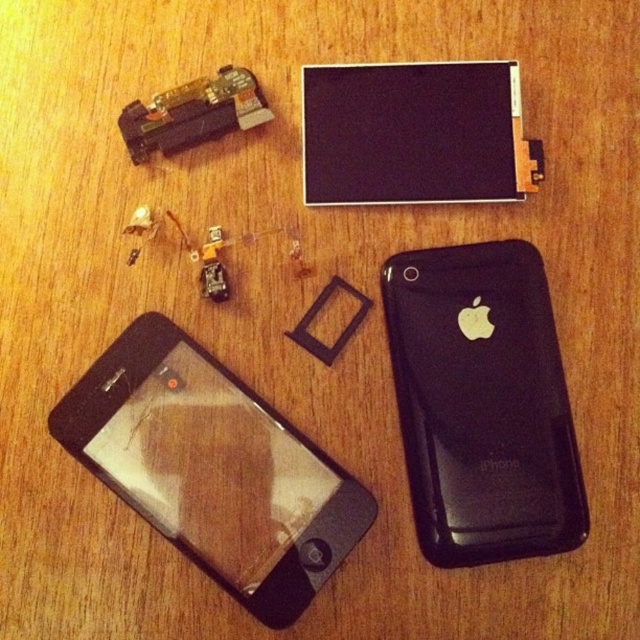
Between black glossy iphone at lower left and black matte iphone at right, which one appears on the right side from the viewer's perspective?

Positioned to the right is black matte iphone at right.

Between black glossy iphone at lower left and black matte iphone at right, which one appears on the left side from the viewer's perspective?

black glossy iphone at lower left is more to the left.

Image resolution: width=640 pixels, height=640 pixels. Identify the location of black glossy iphone at lower left. (212, 468).